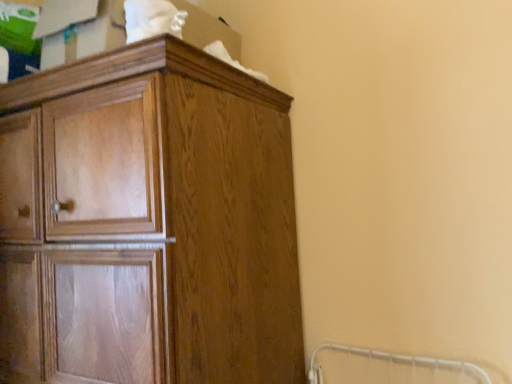
I want to click on wooden cupboard at upper left, so click(x=148, y=223).

Describe the element at coordinates (148, 223) in the screenshot. I see `wooden cupboard at upper left` at that location.

At what (x,y) coordinates should I click in order to perform the action: click on wooden cupboard at upper left. Please return your answer as a coordinate pair (x, y). The height and width of the screenshot is (384, 512). Looking at the image, I should click on (148, 223).